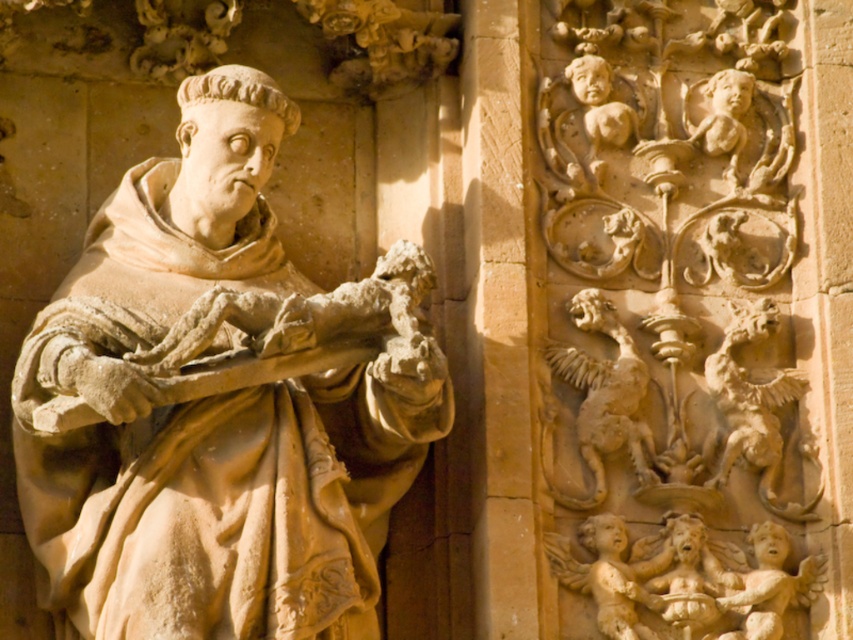
You are an art conservator examining the facade of a religious building. You notice the carved stone griffin at upper right and the smooth beige cherub at lower right. Which of these two carvings is positioned closer to the viewer?

The carved stone griffin at upper right is positioned closer to the viewer than the smooth beige cherub at lower right.

You are an architect examining the stone sculpture on the building facade. You notice a point marked at coordinates (688, 579). What object at this location is part of the carved panel to the right of the monastic figure?

The point at coordinates (688, 579) corresponds to the smooth stone cherub at lower right, which is part of the carved panel to the right of the monastic figure.

You are an art conservator examining the facade. You notice the carved stone griffin at upper right and the smooth beige cherub at lower right. Which of these two carvings is shorter in height?

The carved stone griffin at upper right has a lesser height compared to the smooth beige cherub at lower right, so the carved stone griffin at upper right is shorter in height.